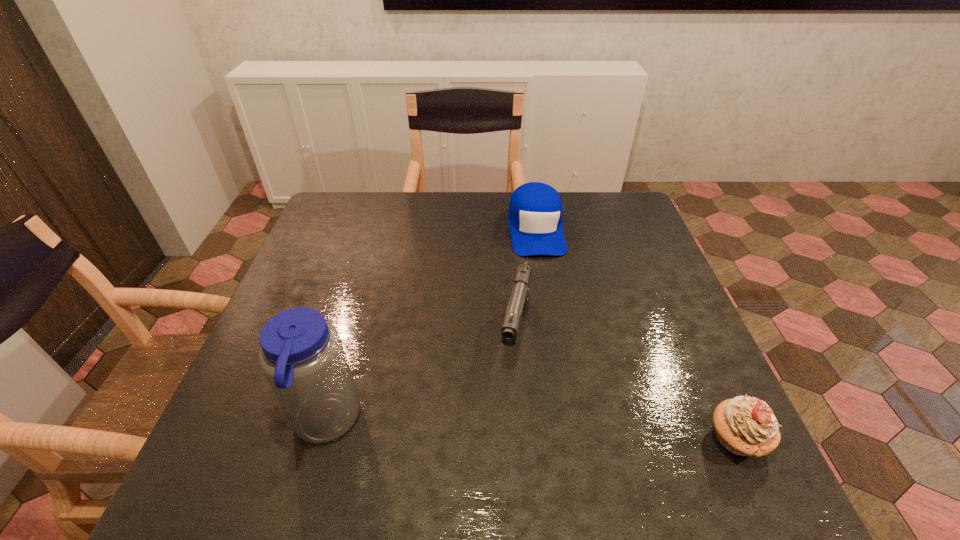
Where is `vacant point located between the gun and the leftmost object`? vacant point located between the gun and the leftmost object is located at coordinates (420, 377).

Find the location of a particular element. empty space that is in between the cupcake and the third nearest object is located at coordinates (626, 386).

You are a GUI agent. You are given a task and a screenshot of the screen. Output one action in this format:
    pyautogui.click(x=<x>, y=<y>)
    Task: Click on the empty location between the rightmost object and the second farthest object
    Image resolution: width=960 pixels, height=540 pixels.
    Given the screenshot: What is the action you would take?
    pyautogui.click(x=626, y=386)

This screenshot has height=540, width=960. Identify the location of object that is the second nearest to the baseball cap. (745, 426).

The width and height of the screenshot is (960, 540). Find the location of `object identified as the second closest to the cupcake`. object identified as the second closest to the cupcake is located at coordinates (535, 209).